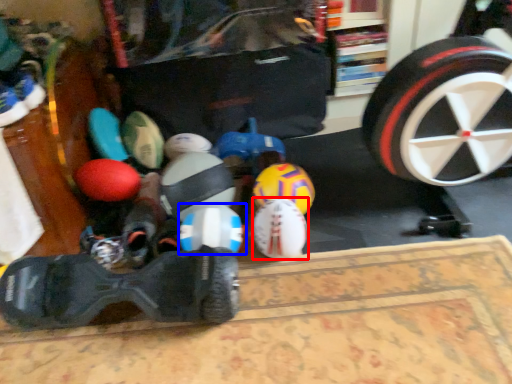
Question: Which object is further to the camera taking this photo, toy (highlighted by a red box) or toy (highlighted by a blue box)?

Choices:
 (A) toy
 (B) toy

Answer: (A)